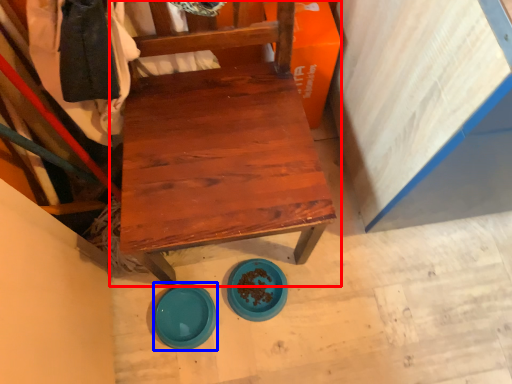
Question: Which point is further to the camera, chair (highlighted by a red box) or plate (highlighted by a blue box)?

Choices:
 (A) chair
 (B) plate

Answer: (B)